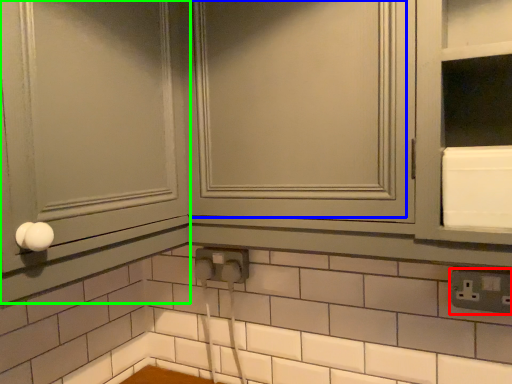
Question: Which is farther away from electric outlet (highlighted by a red box)? window (highlighted by a blue box) or screen door (highlighted by a green box)?

Choices:
 (A) window
 (B) screen door

Answer: (B)